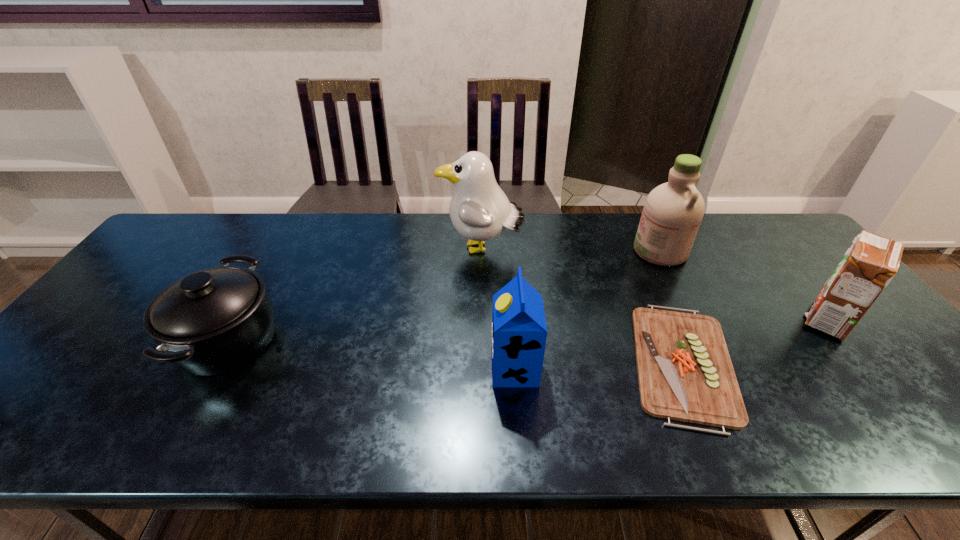
Locate an element on the screen. vacant space at the far right corner of the desktop is located at coordinates (777, 227).

The image size is (960, 540). Identify the location of empty space between the cleansing agent and the rightmost object. (744, 285).

You are a GUI agent. You are given a task and a screenshot of the screen. Output one action in this format:
    pyautogui.click(x=<x>, y=<y>)
    Task: Click on the free spot between the shortest object and the saucepan
    The height and width of the screenshot is (540, 960).
    Given the screenshot: What is the action you would take?
    pyautogui.click(x=455, y=351)

Identify the location of empty space that is in between the shortest object and the cleansing agent. (672, 307).

What are the coordinates of `vacant space that's between the fifth tallest object and the gull` in the screenshot? It's located at (354, 294).

Locate an element on the screen. This screenshot has height=540, width=960. unoccupied area between the gull and the cleansing agent is located at coordinates (570, 250).

You are a GUI agent. You are given a task and a screenshot of the screen. Output one action in this format:
    pyautogui.click(x=<x>, y=<y>)
    Task: Click on the vacant area between the cleansing agent and the chopping board
    
    Given the screenshot: What is the action you would take?
    pyautogui.click(x=672, y=307)

Image resolution: width=960 pixels, height=540 pixels. Identify the location of vacant space that's between the second shortest object and the cleansing agent. (444, 295).

Find the location of a particular element. The height and width of the screenshot is (540, 960). empty space that is in between the gull and the chopping board is located at coordinates pyautogui.click(x=582, y=306).

In order to click on object that is the third closest to the gull in this screenshot , I will do `click(673, 211)`.